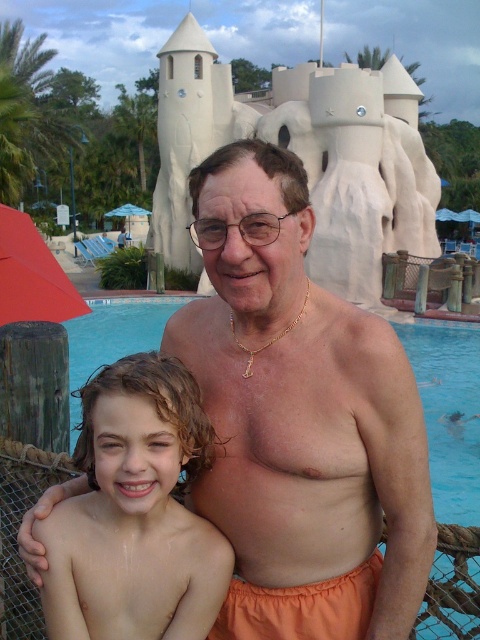
You are a photographer trying to capture a wide shot of the orange fabric shorts at center and the red fabric umbrella at left. Since you want to ensure both items are clearly visible in the frame, which object should you prioritize framing closer to the center of the photo to avoid cropping?

The orange fabric shorts at center should be prioritized closer to the center of the photo because they are wider than the red fabric umbrella at left, making them a larger subject to accommodate in the frame.

You are a photographer at the water park and want to capture a photo of the orange fabric shorts at center and the red fabric umbrella at left. Which object should you focus on first if you want to highlight the larger one?

The orange fabric shorts at center is larger in size than the red fabric umbrella at left, so you should focus on the orange fabric shorts at center first to highlight the larger object.

You are a photographer trying to capture a photo of the orange fabric shorts at center and the transparent plastic umbrella at upper left in the same frame. Given that your camera has a maximum zoom range of 100 meters, can you fit both objects into the frame without moving closer?

The distance between the orange fabric shorts at center and the transparent plastic umbrella at upper left is 103.21 meters, which exceeds the camera maximum zoom range of 100 meters. Therefore, it is not possible to capture both objects in the same frame without moving closer.